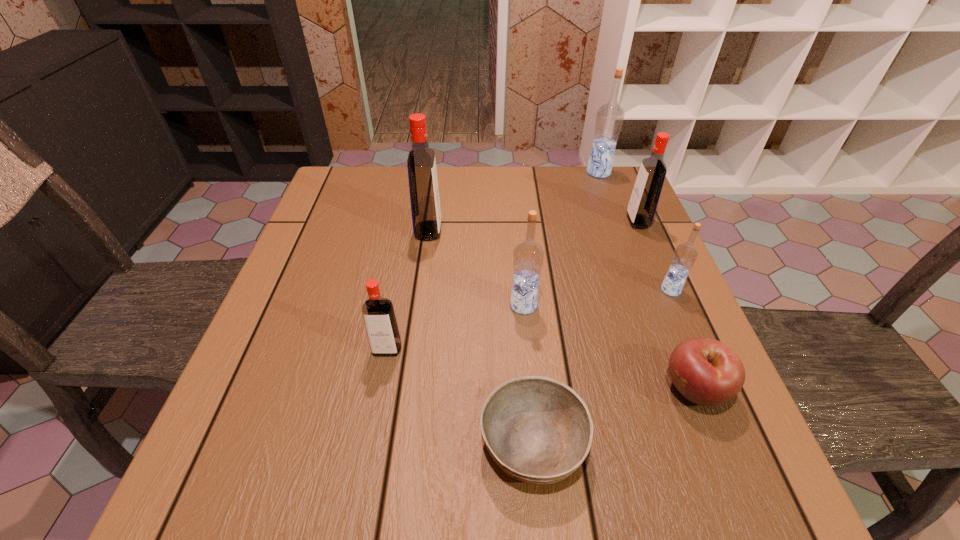
Locate an element on the screen. This screenshot has height=540, width=960. the seventh closest object to the seventh tallest object is located at coordinates (609, 119).

Find the location of a particular element. object that stands as the fourth closest to the second shortest object is located at coordinates (642, 206).

Identify which vodka is the second nearest to the second biggest red vodka. Please provide its 2D coordinates. Your answer should be formatted as a tuple, i.e. [(x, y)], where the tuple contains the x and y coordinates of a point satisfying the conditions above.

[(685, 255)]

This screenshot has width=960, height=540. Find the location of `the closest vodka to the second smallest red vodka`. the closest vodka to the second smallest red vodka is located at coordinates (609, 119).

Where is `blue vodka that can be found as the second closest to the fourth vodka from right to left`? blue vodka that can be found as the second closest to the fourth vodka from right to left is located at coordinates (609, 119).

Choose which blue vodka is the second nearest neighbor to the rightmost blue vodka. Please provide its 2D coordinates. Your answer should be formatted as a tuple, i.e. [(x, y)], where the tuple contains the x and y coordinates of a point satisfying the conditions above.

[(609, 119)]

Select which red vodka is the closest to the sixth farthest object. Please provide its 2D coordinates. Your answer should be formatted as a tuple, i.e. [(x, y)], where the tuple contains the x and y coordinates of a point satisfying the conditions above.

[(423, 183)]

Select which red vodka appears as the second closest to the second biggest red vodka. Please provide its 2D coordinates. Your answer should be formatted as a tuple, i.e. [(x, y)], where the tuple contains the x and y coordinates of a point satisfying the conditions above.

[(378, 313)]

You are a GUI agent. You are given a task and a screenshot of the screen. Output one action in this format:
    pyautogui.click(x=<x>, y=<y>)
    Task: Click on the free spot that satisfies the following two spatial constraints: 1. on the back side of the second biggest blue vodka; 2. on the front and back of the biggest red vodka
    
    Given the screenshot: What is the action you would take?
    pyautogui.click(x=516, y=231)

You are a GUI agent. You are given a task and a screenshot of the screen. Output one action in this format:
    pyautogui.click(x=<x>, y=<y>)
    Task: Click on the free region that satisfies the following two spatial constraints: 1. on the back side of the smallest blue vodka; 2. on the right side of the second biggest blue vodka
    
    Given the screenshot: What is the action you would take?
    pyautogui.click(x=522, y=290)